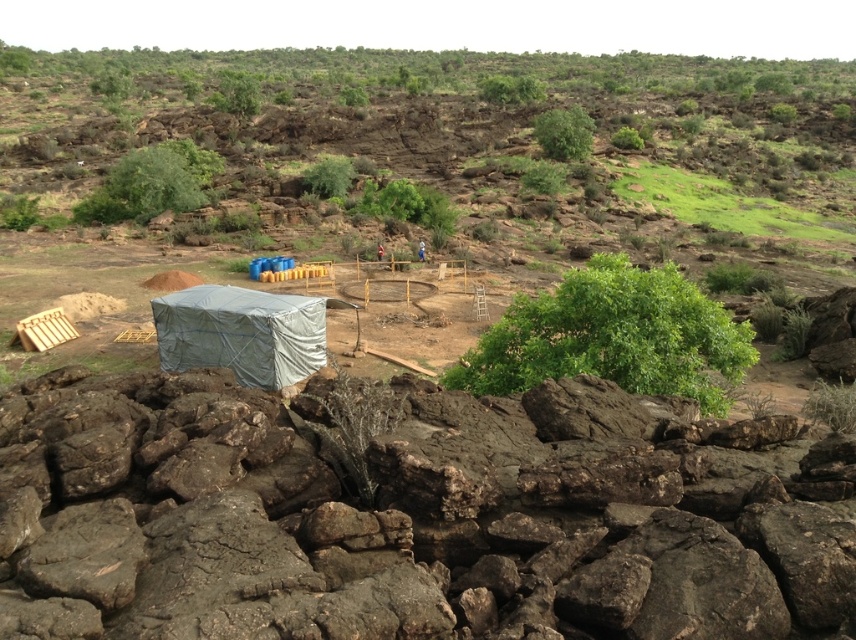
Question: Is green grassy hillside at upper center positioned before gray tarp at center?

Choices:
 (A) no
 (B) yes

Answer: (A)

Question: Can you confirm if green grassy hillside at upper center is positioned below gray tarp at center?

Choices:
 (A) no
 (B) yes

Answer: (A)

Question: Among these points, which one is nearest to the camera?

Choices:
 (A) (176, 296)
 (B) (667, 184)

Answer: (A)

Question: Can you confirm if green grassy hillside at upper center is wider than gray tarp at center?

Choices:
 (A) yes
 (B) no

Answer: (A)

Question: Which point appears farthest from the camera in this image?

Choices:
 (A) (104, 76)
 (B) (201, 292)

Answer: (A)

Question: Which of the following is the farthest from the observer?

Choices:
 (A) (232, 321)
 (B) (642, 211)

Answer: (B)